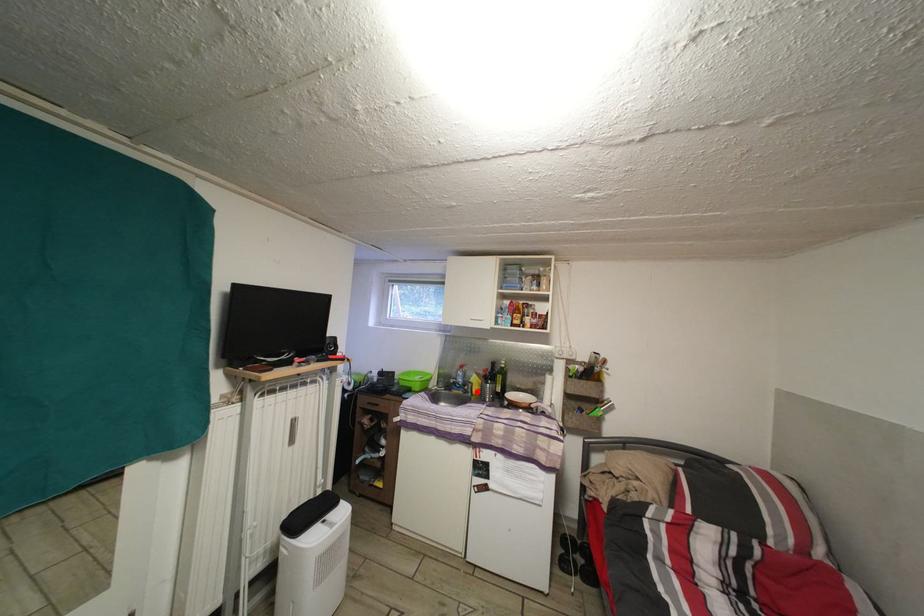
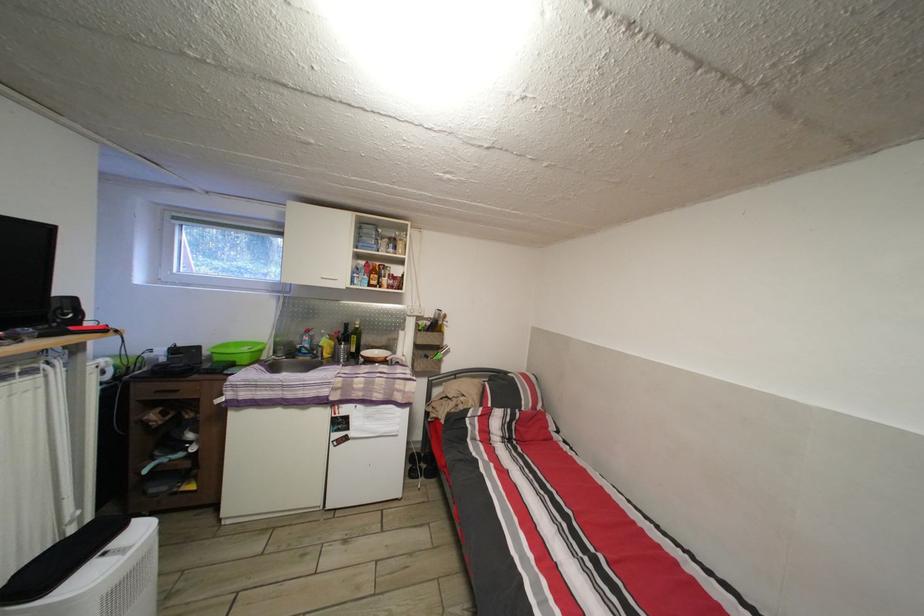
In the second image, find the point that corresponds to the highlighted location in the first image.

(327, 355)